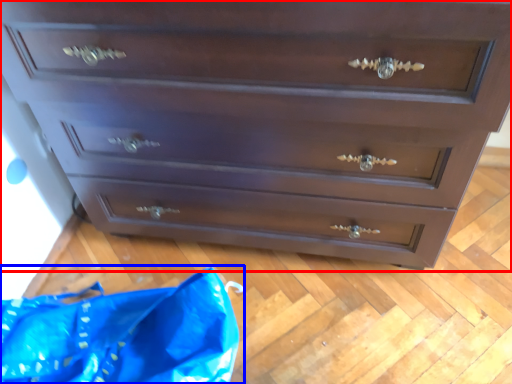
Question: Among these objects, which one is farthest to the camera, chest of drawers (highlighted by a red box) or material (highlighted by a blue box)?

Choices:
 (A) chest of drawers
 (B) material

Answer: (B)